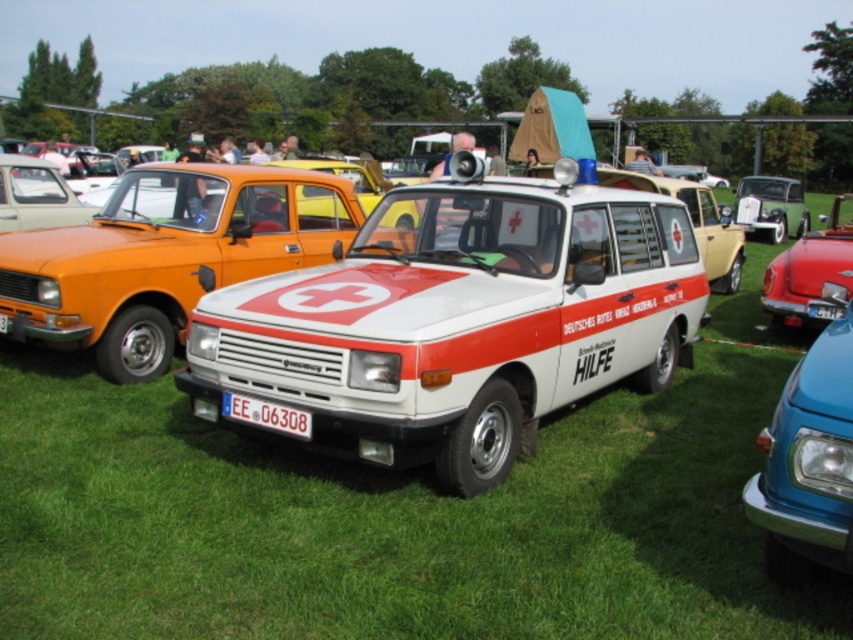
Question: Among these objects, which one is nearest to the camera?

Choices:
 (A) blue glossy van at center
 (B) shiny red car at right
 (C) transparent plastic line at center
 (D) metallic silver car at center

Answer: (A)

Question: Can you confirm if white matte ambulance at center is positioned above shiny red car at right?

Choices:
 (A) no
 (B) yes

Answer: (A)

Question: Does white matte ambulance at center appear over metallic silver car at center?

Choices:
 (A) yes
 (B) no

Answer: (B)

Question: Which of the following is the farthest from the observer?

Choices:
 (A) (764, 221)
 (B) (73, 252)
 (C) (433, 381)

Answer: (A)

Question: Observing the image, what is the correct spatial positioning of metallic silver car at center in reference to white plastic license plate at center?

Choices:
 (A) left
 (B) right

Answer: (B)

Question: Which object appears farthest from the camera in this image?

Choices:
 (A) white plastic license plate at center
 (B) transparent plastic line at center

Answer: (B)